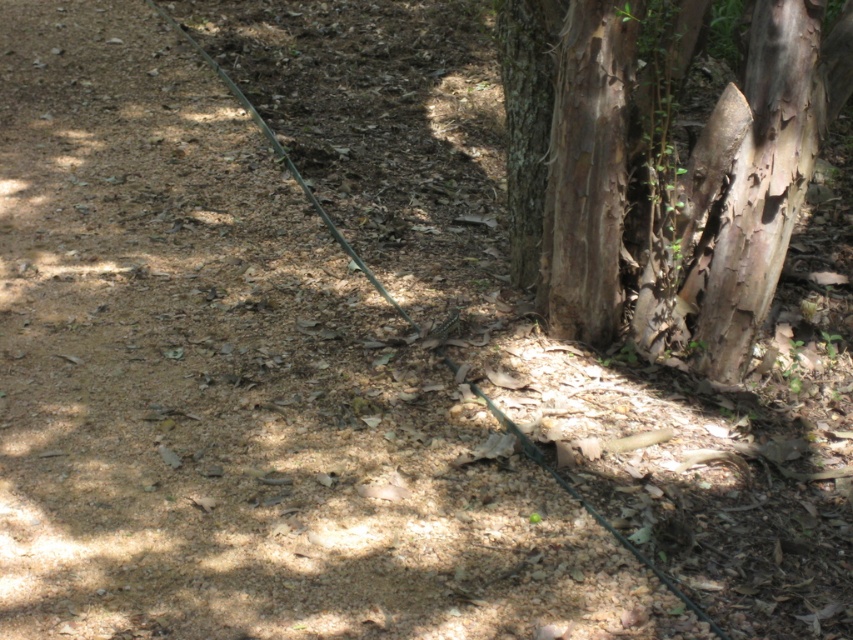
How far apart are smooth bark tree at lower right and brown rough bark tree trunk at center?

6.63 inches

Can you confirm if smooth bark tree at lower right is smaller than brown rough bark tree trunk at center?

No, smooth bark tree at lower right is not smaller than brown rough bark tree trunk at center.

Is point (744, 294) less distant than point (601, 99)?

No, (744, 294) is further to viewer.

At what (x,y) coordinates should I click in order to perform the action: click on smooth bark tree at lower right. Please return your answer as a coordinate pair (x, y). Looking at the image, I should click on (577, 160).

Which is behind, point (808, 52) or point (757, 282)?

Point (757, 282)

Does smooth bark tree at lower right appear on the right side of light brown textured bark at center right?

In fact, smooth bark tree at lower right is to the left of light brown textured bark at center right.

Locate an element on the screen. The height and width of the screenshot is (640, 853). smooth bark tree at lower right is located at coordinates (577, 160).

Locate an element on the screen. light brown textured bark at center right is located at coordinates (762, 182).

Based on the photo, which is below, light brown textured bark at center right or brown rough bark tree trunk at center?

light brown textured bark at center right is below.

Does point (737, 209) come farther from viewer compared to point (602, 129)?

That is True.

The height and width of the screenshot is (640, 853). I want to click on light brown textured bark at center right, so click(762, 182).